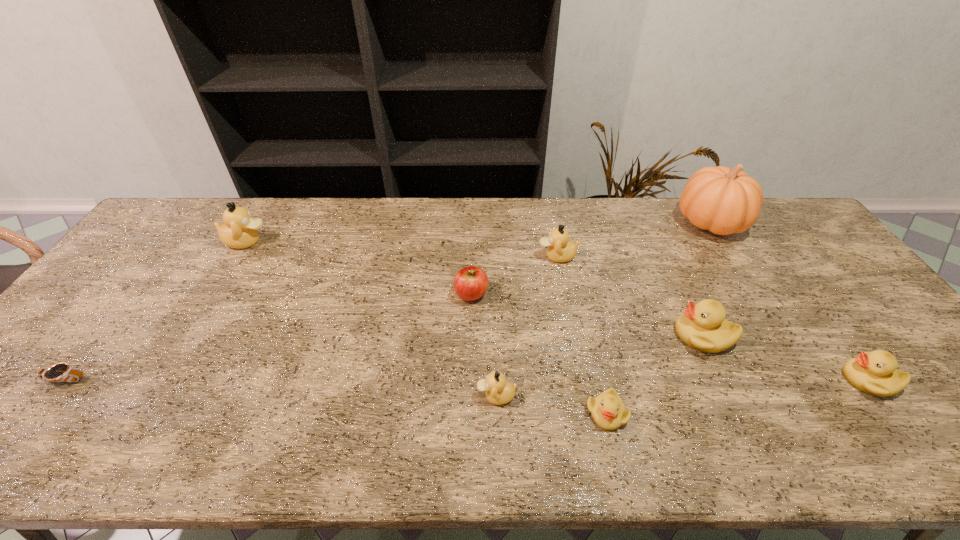
Locate an element on the screen. the second biggest yellow duckling is located at coordinates [875, 373].

Image resolution: width=960 pixels, height=540 pixels. What are the coordinates of `the smallest tan duckling` in the screenshot? It's located at (498, 391).

At what (x,y) coordinates should I click in order to perform the action: click on the second tan duckling from right to left. Please return your answer as a coordinate pair (x, y). Image resolution: width=960 pixels, height=540 pixels. Looking at the image, I should click on (498, 391).

The width and height of the screenshot is (960, 540). I want to click on the second shortest object, so click(x=608, y=411).

Image resolution: width=960 pixels, height=540 pixels. Identify the location of the smallest yellow duckling. (608, 411).

This screenshot has width=960, height=540. I want to click on the leftmost object, so click(61, 372).

You are a GUI agent. You are given a task and a screenshot of the screen. Output one action in this format:
    pyautogui.click(x=<x>, y=<y>)
    Task: Click on the watch
    The height and width of the screenshot is (540, 960).
    Given the screenshot: What is the action you would take?
    pyautogui.click(x=61, y=372)

Identify the location of free location located 0.320m on the front of the pumpkin. This screenshot has height=540, width=960. (774, 323).

Locate an element on the screen. vacant space situated 0.270m on the face of the leftmost duckling is located at coordinates (353, 242).

Identify the location of vacant space located on the face of the second biggest tan duckling. This screenshot has width=960, height=540. (464, 256).